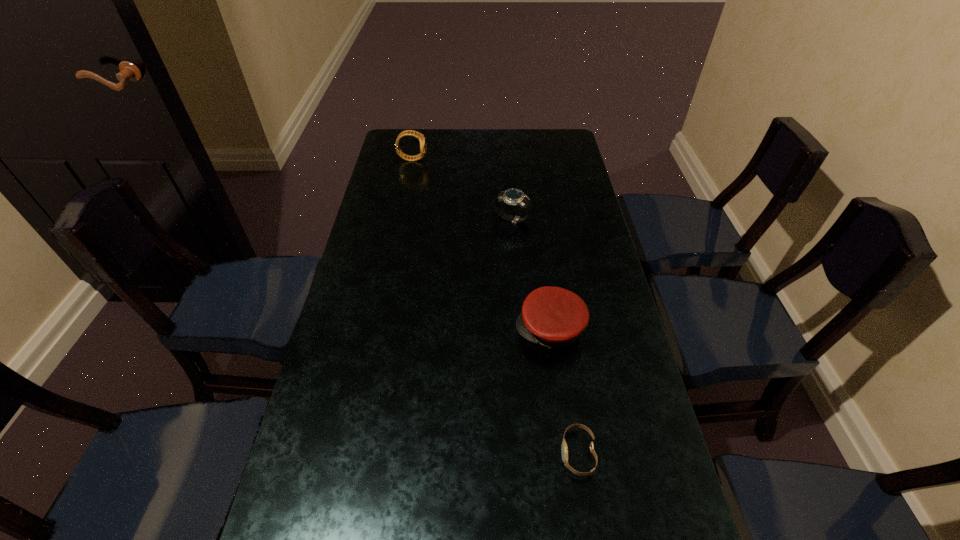
What are the coordinates of `free space between the farthest watch and the third tallest object` in the screenshot? It's located at (481, 244).

Find the location of a particular element. vacant area that lies between the farthest watch and the second nearest watch is located at coordinates (462, 189).

This screenshot has width=960, height=540. I want to click on empty space between the leftmost object and the second watch from right to left, so point(462,189).

Identify the location of object that is the closest to the second nearest object. This screenshot has height=540, width=960. (564, 449).

Find the location of a particular element. This screenshot has width=960, height=540. object that is the third closest one to the second farthest watch is located at coordinates (564, 449).

Locate which watch is the closest to the leftmost object. Please provide its 2D coordinates. Your answer should be formatted as a tuple, i.e. [(x, y)], where the tuple contains the x and y coordinates of a point satisfying the conditions above.

[(513, 196)]

Identify which watch is the second nearest to the leftmost object. Please provide its 2D coordinates. Your answer should be formatted as a tuple, i.e. [(x, y)], where the tuple contains the x and y coordinates of a point satisfying the conditions above.

[(564, 449)]

Where is `free space that satisfies the following two spatial constraints: 1. on the face of the leftmost watch; 2. on the left side of the second farthest object`? free space that satisfies the following two spatial constraints: 1. on the face of the leftmost watch; 2. on the left side of the second farthest object is located at coordinates (400, 219).

Where is `blank area in the image that satisfies the following two spatial constraints: 1. on the face of the farthest watch; 2. on the right side of the second farthest watch`? The image size is (960, 540). blank area in the image that satisfies the following two spatial constraints: 1. on the face of the farthest watch; 2. on the right side of the second farthest watch is located at coordinates (400, 219).